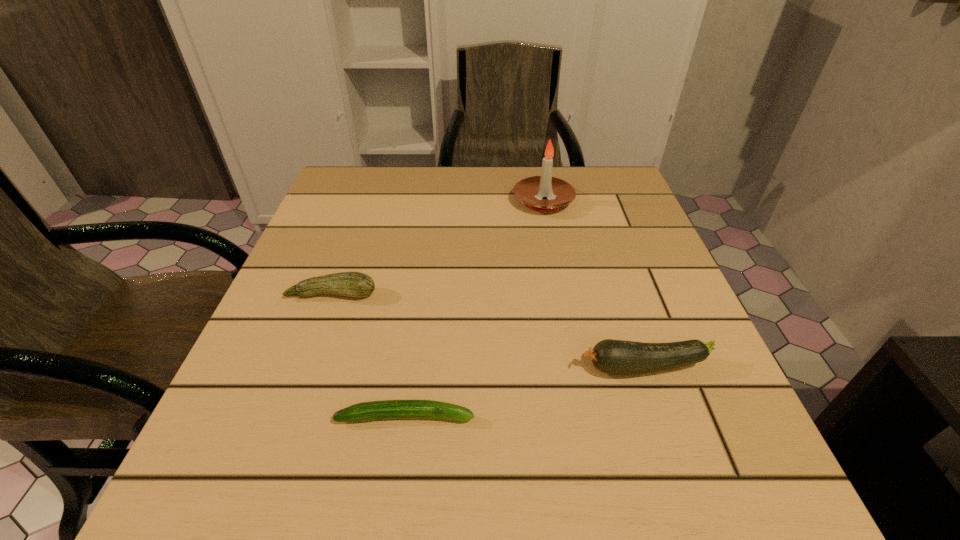
The width and height of the screenshot is (960, 540). In the image, there is a desktop. In order to click on vacant space at the near edge in this screenshot , I will do `click(531, 448)`.

Where is `vacant area at the left edge of the desktop`? vacant area at the left edge of the desktop is located at coordinates pyautogui.click(x=359, y=255).

This screenshot has width=960, height=540. Find the location of `free spot at the right edge of the desktop`. free spot at the right edge of the desktop is located at coordinates (609, 232).

In the image, there is a desktop. At what (x,y) coordinates should I click in order to perform the action: click on vacant space at the far right corner. Please return your answer as a coordinate pair (x, y). The width and height of the screenshot is (960, 540). Looking at the image, I should click on (577, 166).

I want to click on free space at the near right corner, so click(771, 514).

The height and width of the screenshot is (540, 960). What are the coordinates of `empty space between the nearest object and the tallest object` in the screenshot? It's located at (474, 309).

Locate an element on the screen. This screenshot has height=540, width=960. free space between the candle and the shortest zucchini is located at coordinates (474, 309).

Locate an element on the screen. free area in between the third farthest object and the nearest object is located at coordinates (525, 392).

Identify the location of vacant space in between the tallest object and the nearest object. The height and width of the screenshot is (540, 960). (474, 309).

At what (x,y) coordinates should I click in order to perform the action: click on unoccupied area between the third tallest object and the third farthest object. Please return your answer as a coordinate pair (x, y). Looking at the image, I should click on (489, 331).